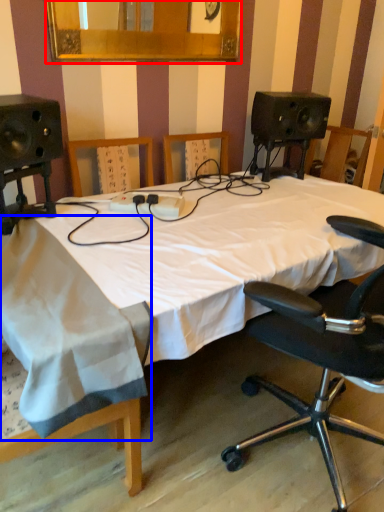
Question: Which of the following is the farthest to the observer, mirror (highlighted by a red box) or sheet (highlighted by a blue box)?

Choices:
 (A) mirror
 (B) sheet

Answer: (A)